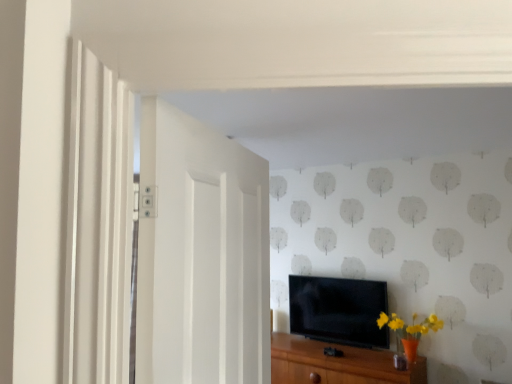
Based on the photo, measure the distance between point (345, 334) and camera.

A distance of 3.72 meters exists between point (345, 334) and camera.

Where is `white painted wood door at left`? The image size is (512, 384). white painted wood door at left is located at coordinates (201, 255).

The width and height of the screenshot is (512, 384). What are the coordinates of `brown wood cabinet at lower center` in the screenshot? It's located at (337, 364).

Where is `black glossy tv at center`? The image size is (512, 384). black glossy tv at center is located at coordinates [x=338, y=310].

Can you confirm if white painted wood door at left is positioned to the left of brown wood cabinet at lower center?

Correct, you'll find white painted wood door at left to the left of brown wood cabinet at lower center.

Does white painted wood door at left lie behind brown wood cabinet at lower center?

No, white painted wood door at left is closer to the viewer.

Is white painted wood door at left positioned far away from brown wood cabinet at lower center?

Yes.

Is brown wood cabinet at lower center located within white painted wood door at left?

No, brown wood cabinet at lower center is located outside of white painted wood door at left.

In the scene shown: Between white painted wood door at left and black glossy tv at center, which one has more height?

white painted wood door at left is taller.

Considering the relative positions of white painted wood door at left and black glossy tv at center in the image provided, is white painted wood door at left to the left or to the right of black glossy tv at center?

white painted wood door at left is to the left of black glossy tv at center.

Is white painted wood door at left not near black glossy tv at center?

white painted wood door at left is far away from black glossy tv at center.

Is black glossy tv at center thinner than white painted wood door at left?

Yes, black glossy tv at center is thinner than white painted wood door at left.

Is black glossy tv at center facing towards white painted wood door at left?

Yes, black glossy tv at center is facing white painted wood door at left.

Which is correct: black glossy tv at center is inside white painted wood door at left, or outside of it?

black glossy tv at center is not enclosed by white painted wood door at left.

From the image's perspective, would you say black glossy tv at center is positioned over white painted wood door at left?

Actually, black glossy tv at center appears below white painted wood door at left in the image.

Considering the sizes of objects black glossy tv at center and brown wood cabinet at lower center in the image provided, who is bigger, black glossy tv at center or brown wood cabinet at lower center?

brown wood cabinet at lower center is bigger.

Considering the sizes of objects black glossy tv at center and brown wood cabinet at lower center in the image provided, who is wider, black glossy tv at center or brown wood cabinet at lower center?

With larger width is brown wood cabinet at lower center.

From a real-world perspective, is black glossy tv at center beneath brown wood cabinet at lower center?

No.

Is point (342, 324) closer to camera compared to point (281, 337)?

Yes.

Is the position of brown wood cabinet at lower center more distant than that of white painted wood door at left?

Yes, brown wood cabinet at lower center is further from the camera.

From the image's perspective, which object appears higher, brown wood cabinet at lower center or white painted wood door at left?

white painted wood door at left is shown above in the image.

Considering the positions of objects brown wood cabinet at lower center and white painted wood door at left in the image provided, who is more to the left, brown wood cabinet at lower center or white painted wood door at left?

white painted wood door at left.

This screenshot has height=384, width=512. Find the location of `cabinetry in front of the black glossy tv at center`. cabinetry in front of the black glossy tv at center is located at coordinates (337, 364).

Considering the sizes of brown wood cabinet at lower center and black glossy tv at center in the image, is brown wood cabinet at lower center bigger or smaller than black glossy tv at center?

Clearly, brown wood cabinet at lower center is larger in size than black glossy tv at center.

Are brown wood cabinet at lower center and black glossy tv at center located far from each other?

brown wood cabinet at lower center is actually quite close to black glossy tv at center.

Is brown wood cabinet at lower center shorter than black glossy tv at center?

Yes.

Locate an element on the screen. Image resolution: width=512 pixels, height=384 pixels. cabinetry directly beneath the white painted wood door at left (from a real-world perspective) is located at coordinates (337, 364).

Where is `television located on the right of white painted wood door at left`? The width and height of the screenshot is (512, 384). television located on the right of white painted wood door at left is located at coordinates pyautogui.click(x=338, y=310).

From the image, which object appears to be nearer to black glossy tv at center, white painted wood door at left or brown wood cabinet at lower center?

brown wood cabinet at lower center is positioned closer to the anchor black glossy tv at center.

Estimate the real-world distances between objects in this image. Which object is closer to brown wood cabinet at lower center, white painted wood door at left or black glossy tv at center?

black glossy tv at center is positioned closer to the anchor brown wood cabinet at lower center.

Based on their spatial positions, is black glossy tv at center or white painted wood door at left further from brown wood cabinet at lower center?

The object further to brown wood cabinet at lower center is white painted wood door at left.

Based on the photo, based on their spatial positions, is brown wood cabinet at lower center or white painted wood door at left further from black glossy tv at center?

white painted wood door at left.

When comparing their distances from white painted wood door at left, does black glossy tv at center or brown wood cabinet at lower center seem closer?

brown wood cabinet at lower center is positioned closer to the anchor white painted wood door at left.

Looking at the image, which one is located further to white painted wood door at left, brown wood cabinet at lower center or black glossy tv at center?

black glossy tv at center is positioned further to the anchor white painted wood door at left.

The image size is (512, 384). I want to click on cabinetry positioned between white painted wood door at left and black glossy tv at center from near to far, so 337,364.